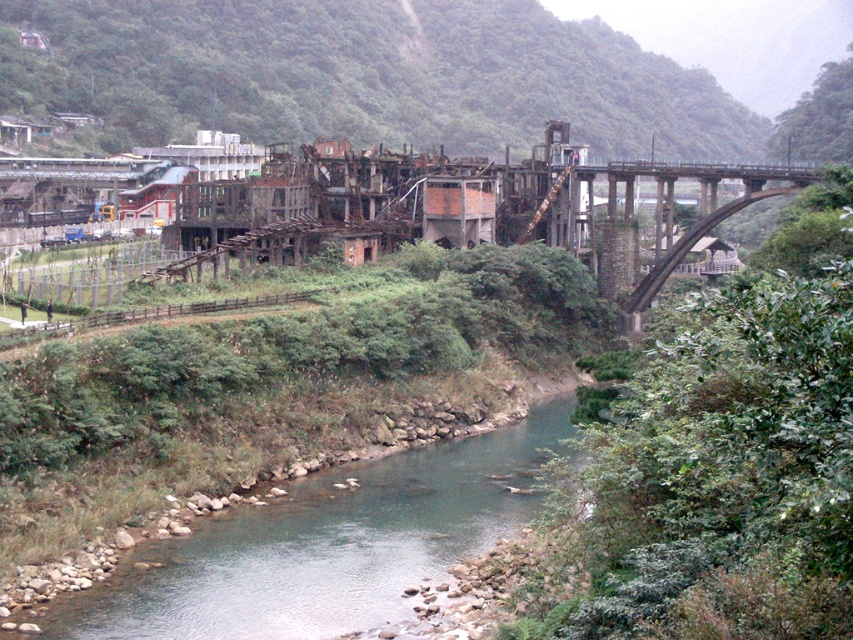
Question: Is clear water at center closer to camera compared to concrete arch bridge at right?

Choices:
 (A) no
 (B) yes

Answer: (B)

Question: Which object is closer to the camera taking this photo?

Choices:
 (A) concrete arch bridge at right
 (B) clear water at center

Answer: (B)

Question: Is clear water at center further to camera compared to concrete arch bridge at right?

Choices:
 (A) yes
 (B) no

Answer: (B)

Question: Which point is closer to the camera?

Choices:
 (A) (650, 280)
 (B) (471, 442)

Answer: (B)

Question: Is clear water at center above concrete arch bridge at right?

Choices:
 (A) no
 (B) yes

Answer: (A)